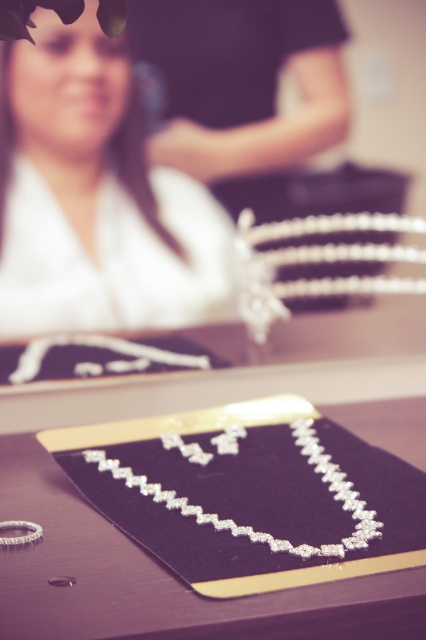
You are a jeweler trying to fit two pieces of jewelry into a display case. The case has two compartments with the first compartment being 10 cm wide and the second compartment being 15 cm wide. Given the matte black jewelry at center and the clear crystal necklace at center, which jewelry piece should go into which compartment to ensure they both fit properly?

The matte black jewelry at center is wider than the clear crystal necklace at center. Therefore, the matte black jewelry at center should be placed in the 15 cm wide compartment, and the clear crystal necklace at center should go into the 10 cm wide compartment to ensure proper fitting.

You are standing in front of a jewelry display and want to take a photo of the necklace. The camera you are using has a focus range of 1.5 to 2.0 meters. Is the point at coordinates point (66, 99) within the camera focus range?

The distance of point (66, 99) from the camera is 1.70 meters, which falls within the camera focus range of 1.5 to 2.0 meters. Therefore, the point at coordinates point (66, 99) is within the camera focus range.